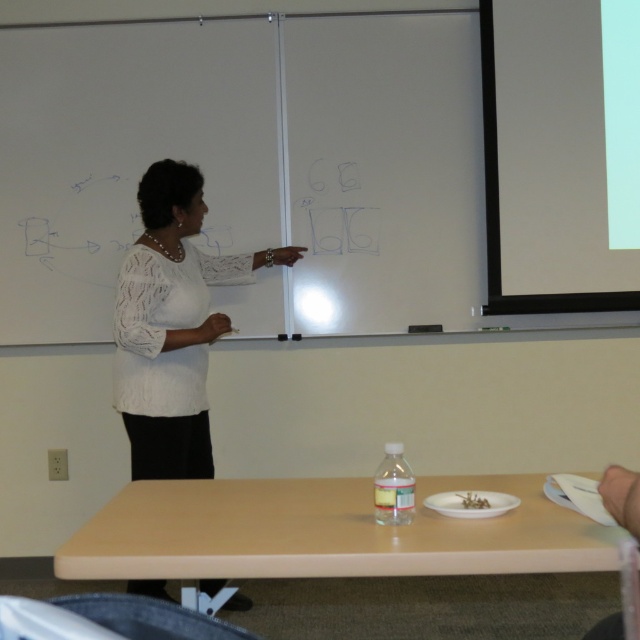
Does point (561, 172) come in front of point (152, 273)?

No.

Who is taller, white matte projection screen at upper right or white lace blouse at upper center?

Standing taller between the two is white matte projection screen at upper right.

This screenshot has height=640, width=640. In order to click on white matte projection screen at upper right in this screenshot , I will do `click(561, 154)`.

Does light brown laminate table at lower center appear under white lace blouse at upper center?

Correct, light brown laminate table at lower center is located below white lace blouse at upper center.

Which is in front, point (106, 550) or point (209, 586)?

Point (106, 550)

Is point (420, 522) closer to camera compared to point (193, 408)?

That is True.

Where is `light brown laminate table at lower center`? light brown laminate table at lower center is located at coordinates (324, 532).

Is white matte projection screen at upper right shorter than light brown laminate table at lower center?

In fact, white matte projection screen at upper right may be taller than light brown laminate table at lower center.

Is point (620, 147) positioned before point (531, 556)?

No, it is behind (531, 556).

This screenshot has width=640, height=640. In order to click on white matte projection screen at upper right in this screenshot , I will do `click(561, 154)`.